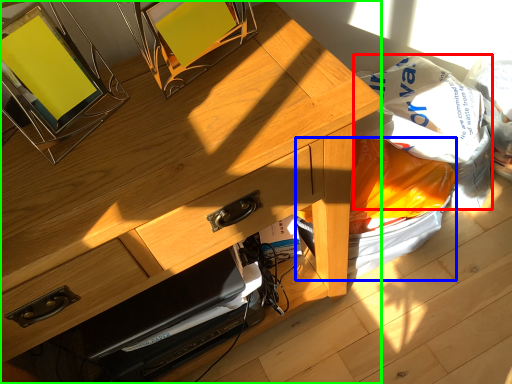
Question: Which object is positioned farthest from grocery bag (highlighted by a red box)? Select from garbage (highlighted by a blue box) and desk (highlighted by a green box).

Choices:
 (A) garbage
 (B) desk

Answer: (B)